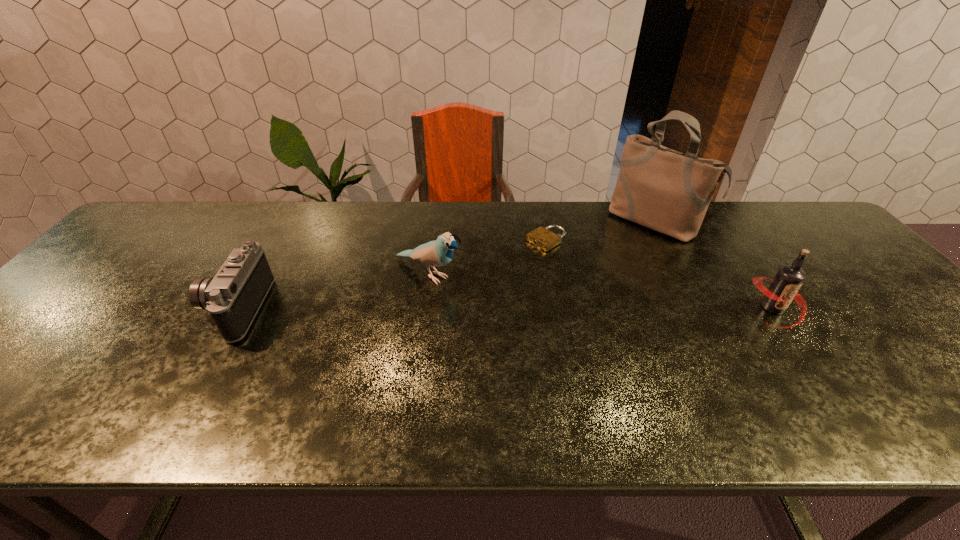
At what (x,y) coordinates should I click in order to perform the action: click on vacant space on the desktop that is between the camera and the root beer and is positioned at the face of the bird. Please return your answer as a coordinate pair (x, y). The width and height of the screenshot is (960, 540). Looking at the image, I should click on (493, 308).

You are a GUI agent. You are given a task and a screenshot of the screen. Output one action in this format:
    pyautogui.click(x=<x>, y=<y>)
    Task: Click on the free space on the desktop that is between the camera and the root beer and is positioned on the keyhole side of the third object from right to left
    
    Given the screenshot: What is the action you would take?
    [x=435, y=308]

Identify the location of vacant space on the desktop that is between the leftmost object and the root beer and is positioned on the front-facing side of the tallest object. The height and width of the screenshot is (540, 960). (577, 308).